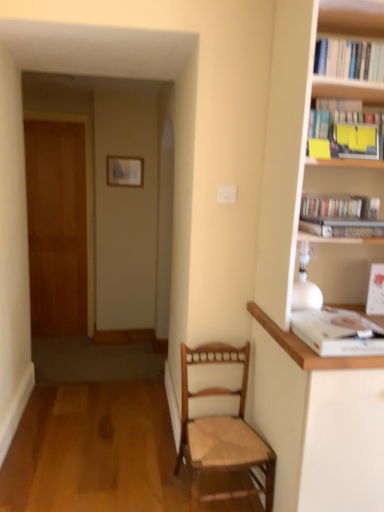
Question: Is hardcover book at upper right, marked as the 4th book in a top-to-bottom arrangement, completely or partially outside of hardcover books at upper right, the third book ordered from the bottom?

Choices:
 (A) yes
 (B) no

Answer: (A)

Question: Is hardcover book at upper right, the 2th book in the bottom-to-top sequence, touching hardcover books at upper right, the 3th book when ordered from top to bottom?

Choices:
 (A) no
 (B) yes

Answer: (B)

Question: From a real-world perspective, is hardcover book at upper right, the 2th book in the bottom-to-top sequence, beneath hardcover books at upper right, the 3th book when ordered from top to bottom?

Choices:
 (A) yes
 (B) no

Answer: (A)

Question: Can you confirm if hardcover book at upper right, the 2th book in the bottom-to-top sequence, is taller than hardcover books at upper right, the third book ordered from the bottom?

Choices:
 (A) no
 (B) yes

Answer: (A)

Question: Is the position of hardcover book at upper right, the 2th book in the bottom-to-top sequence, more distant than that of hardcover books at upper right, the 3th book when ordered from top to bottom?

Choices:
 (A) no
 (B) yes

Answer: (A)

Question: Considering the relative positions of hardcover book at upper right, the 2th book in the bottom-to-top sequence, and hardcover books at upper right, the third book ordered from the bottom, in the image provided, is hardcover book at upper right, the 2th book in the bottom-to-top sequence, to the right of hardcover books at upper right, the third book ordered from the bottom, from the viewer's perspective?

Choices:
 (A) yes
 (B) no

Answer: (B)

Question: Is white paper book at upper right, which is counted as the first book, starting from the bottom, located within hardcover books at upper right, the 3th book when ordered from top to bottom?

Choices:
 (A) no
 (B) yes

Answer: (A)

Question: Is hardcover books at upper right, the 3th book when ordered from top to bottom, far from white paper book at upper right, which is counted as the first book, starting from the bottom?

Choices:
 (A) no
 (B) yes

Answer: (A)

Question: Does hardcover books at upper right, the 3th book when ordered from top to bottom, have a lesser width compared to white paper book at upper right, which is counted as the first book, starting from the bottom?

Choices:
 (A) yes
 (B) no

Answer: (A)

Question: Is hardcover books at upper right, the 3th book when ordered from top to bottom, bigger than white paper book at upper right, the fifth book positioned from the top?

Choices:
 (A) no
 (B) yes

Answer: (B)

Question: Is hardcover books at upper right, the third book ordered from the bottom, positioned behind white paper book at upper right, which is counted as the first book, starting from the bottom?

Choices:
 (A) yes
 (B) no

Answer: (A)

Question: Is hardcover books at upper right, the third book ordered from the bottom, to the right of white paper book at upper right, the fifth book positioned from the top, from the viewer's perspective?

Choices:
 (A) no
 (B) yes

Answer: (B)

Question: From a real-world perspective, is yellow paper at upper right, which appears as the fourth book when ordered from the bottom, over white paper book at upper right, which is counted as the first book, starting from the bottom?

Choices:
 (A) no
 (B) yes

Answer: (B)